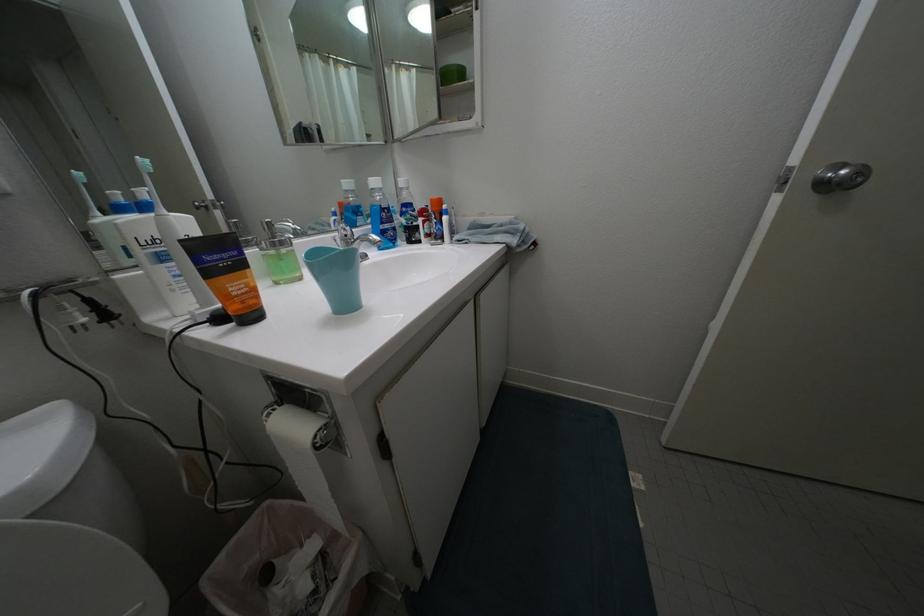
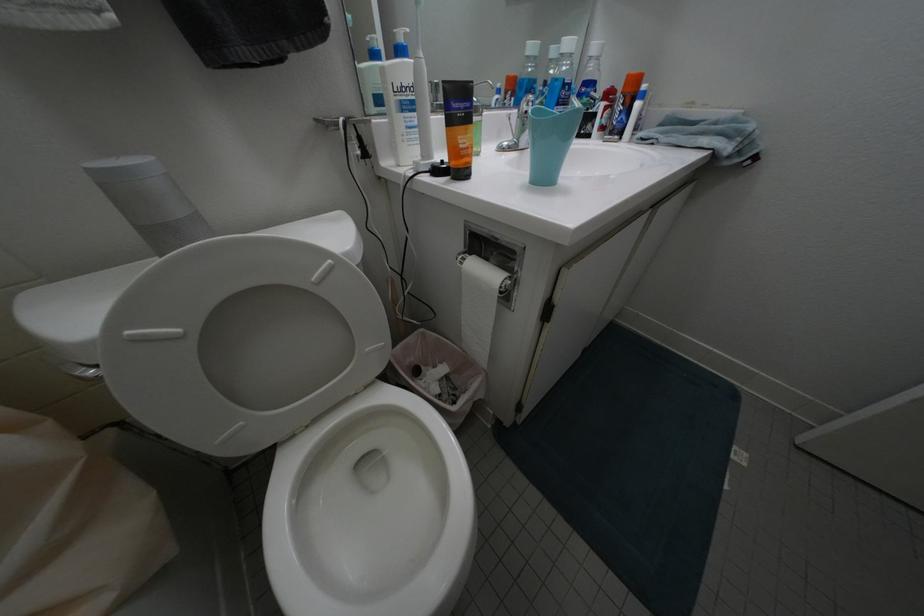
The first image is from the beginning of the video and the second image is from the end. How did the camera likely rotate when shooting the video?

The rotation direction of the camera is left-down.